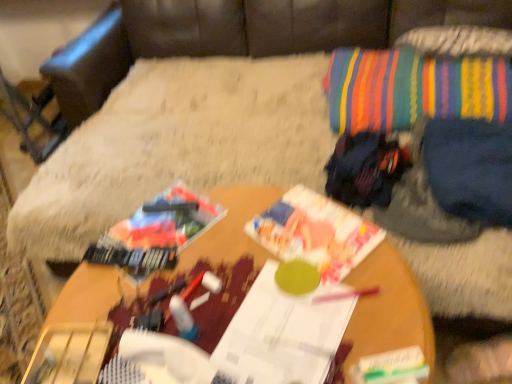
Question: Should I look upward or downward to see dark blue fabric at upper right?

Choices:
 (A) down
 (B) up

Answer: (B)

Question: From the image's perspective, does dark blue fabric at upper right appear higher than white paper magazine at center, positioned as the 1th magazine in bottom-to-top order?

Choices:
 (A) yes
 (B) no

Answer: (A)

Question: Can you confirm if dark blue fabric at upper right is smaller than white paper magazine at center, positioned as the 1th magazine in bottom-to-top order?

Choices:
 (A) yes
 (B) no

Answer: (B)

Question: Considering the relative sizes of dark blue fabric at upper right and white paper magazine at center, arranged as the second magazine when viewed from the top, in the image provided, is dark blue fabric at upper right taller than white paper magazine at center, arranged as the second magazine when viewed from the top,?

Choices:
 (A) yes
 (B) no

Answer: (A)

Question: Can you confirm if dark blue fabric at upper right is shorter than white paper magazine at center, arranged as the second magazine when viewed from the top?

Choices:
 (A) yes
 (B) no

Answer: (B)

Question: From a real-world perspective, is dark blue fabric at upper right below white paper magazine at center, positioned as the 1th magazine in bottom-to-top order?

Choices:
 (A) no
 (B) yes

Answer: (B)

Question: Would you say dark blue fabric at upper right contains white paper magazine at center, arranged as the second magazine when viewed from the top?

Choices:
 (A) yes
 (B) no

Answer: (B)

Question: Is dark blue fabric at upper right turned away from striped fabric throw pillow at upper right?

Choices:
 (A) yes
 (B) no

Answer: (A)

Question: From the image's perspective, is dark blue fabric at upper right below striped fabric throw pillow at upper right?

Choices:
 (A) no
 (B) yes

Answer: (B)

Question: From the image's perspective, is dark blue fabric at upper right above striped fabric throw pillow at upper right?

Choices:
 (A) no
 (B) yes

Answer: (A)

Question: Is dark blue fabric at upper right closer to camera compared to striped fabric throw pillow at upper right?

Choices:
 (A) yes
 (B) no

Answer: (A)

Question: Considering the relative positions of dark blue fabric at upper right and striped fabric throw pillow at upper right in the image provided, is dark blue fabric at upper right to the right of striped fabric throw pillow at upper right from the viewer's perspective?

Choices:
 (A) no
 (B) yes

Answer: (B)

Question: Is dark blue fabric at upper right to the left of striped fabric throw pillow at upper right from the viewer's perspective?

Choices:
 (A) no
 (B) yes

Answer: (A)

Question: From a real-world perspective, is white paper magazine at center, positioned as the 1th magazine in bottom-to-top order, beneath multicolored fabric bean bag chair at upper right?

Choices:
 (A) no
 (B) yes

Answer: (A)